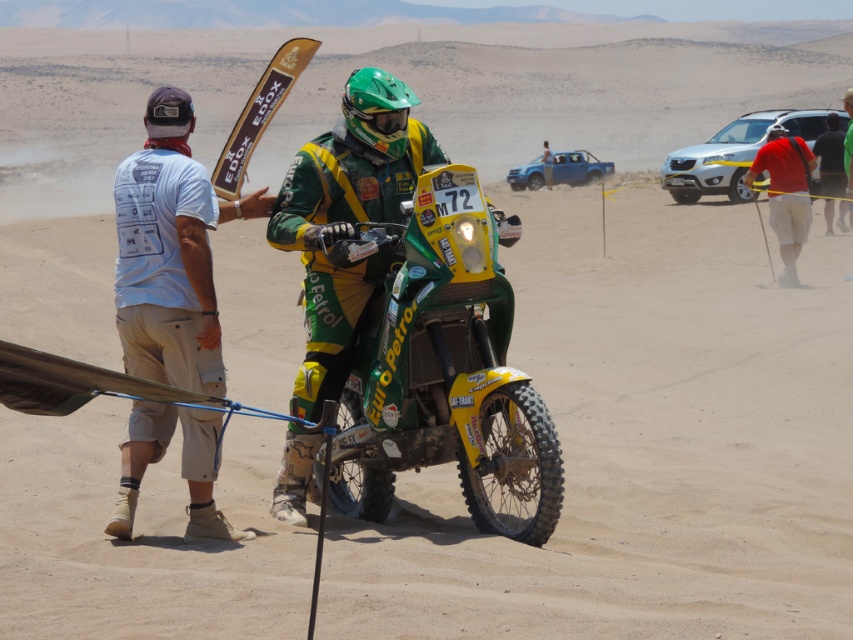
Question: Considering the real-world distances, which object is closest to the white cotton shirt at left?

Choices:
 (A) silver metallic suv at right
 (B) blue metallic truck at upper center
 (C) red cotton shorts at right
 (D) green matte motorcycle at center

Answer: (D)

Question: Can you confirm if silver metallic suv at right is bigger than red cotton shorts at right?

Choices:
 (A) yes
 (B) no

Answer: (A)

Question: Observing the image, what is the correct spatial positioning of white cotton shirt at left in reference to blue metallic truck at upper center?

Choices:
 (A) left
 (B) right

Answer: (A)

Question: Where is green matte motorcycle at center located in relation to red cotton shorts at right in the image?

Choices:
 (A) left
 (B) right

Answer: (A)

Question: Which point is farther to the camera?

Choices:
 (A) (590, 154)
 (B) (428, 221)

Answer: (A)

Question: Based on their relative distances, which object is nearer to the white cotton shirt at left?

Choices:
 (A) blue metallic truck at upper center
 (B) silver metallic suv at right
 (C) red cotton shorts at right

Answer: (C)